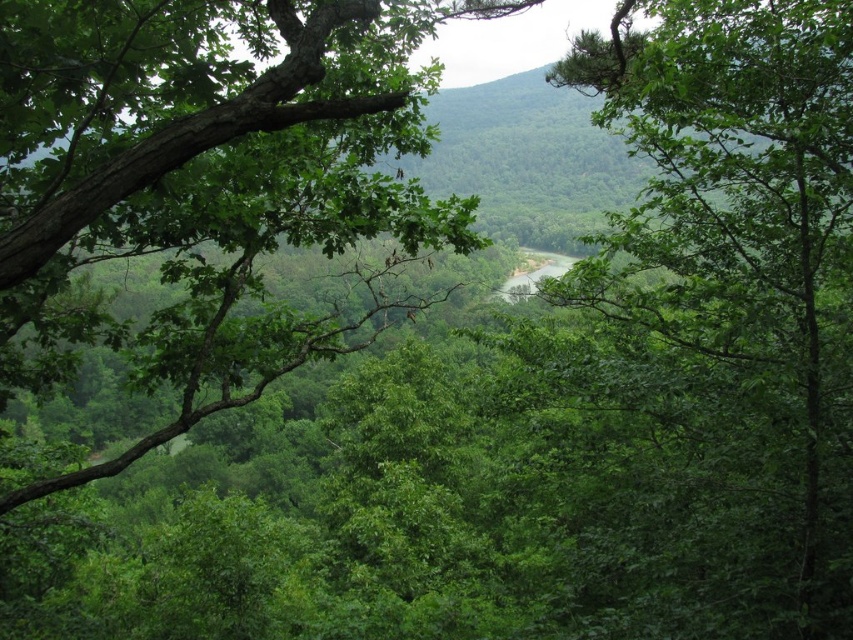
Question: Can you confirm if green leafy tree at center is positioned to the right of green rough bark tree at left?

Choices:
 (A) no
 (B) yes

Answer: (B)

Question: Which point is farther to the camera?

Choices:
 (A) green leafy tree at center
 (B) green rough bark tree at left

Answer: (A)

Question: Which of the following is the farthest from the observer?

Choices:
 (A) (117, 224)
 (B) (741, 365)

Answer: (B)

Question: Observing the image, what is the correct spatial positioning of green leafy tree at center in reference to green rough bark tree at left?

Choices:
 (A) right
 (B) left

Answer: (A)

Question: Does green leafy tree at center appear under green rough bark tree at left?

Choices:
 (A) yes
 (B) no

Answer: (B)